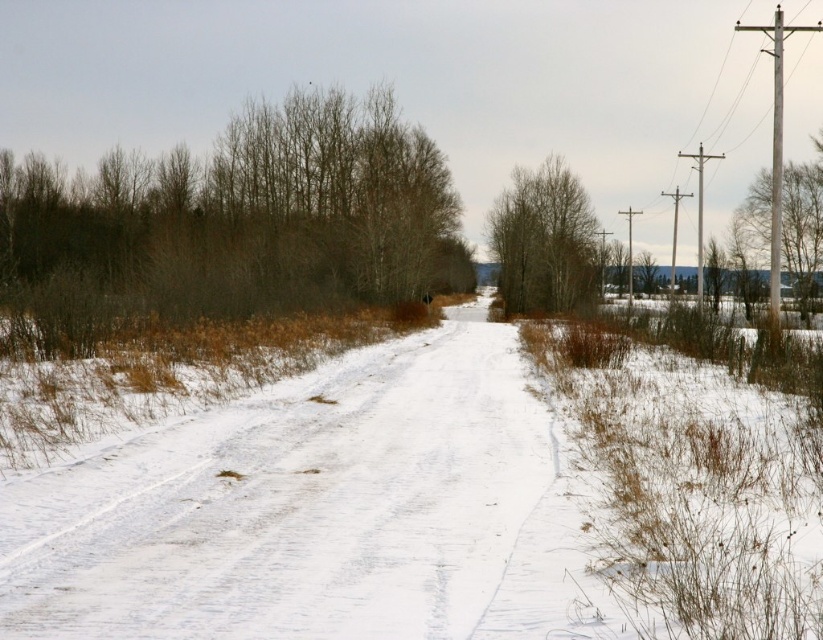
This screenshot has width=823, height=640. What do you see at coordinates (543, 241) in the screenshot?
I see `brown/dry wood at center` at bounding box center [543, 241].

Which is behind, point (573, 218) or point (751, 228)?

The point (751, 228) is more distant.

Where is `brown/dry wood at center`? The height and width of the screenshot is (640, 823). brown/dry wood at center is located at coordinates (543, 241).

Can you confirm if brown/dry wood at left is positioned above smooth wood pole at right?

Indeed, brown/dry wood at left is positioned over smooth wood pole at right.

Which is behind, point (379, 291) or point (746, 221)?

Point (746, 221)

Who is more distant from viewer, (228, 134) or (807, 276)?

Positioned behind is point (228, 134).

The width and height of the screenshot is (823, 640). Find the location of `brown/dry wood at left`. brown/dry wood at left is located at coordinates (231, 225).

Is brown/dry wood at left taller than brown/dry wood at center?

Indeed, brown/dry wood at left has a greater height compared to brown/dry wood at center.

Is brown/dry wood at left to the right of brown/dry wood at center from the viewer's perspective?

Incorrect, brown/dry wood at left is not on the right side of brown/dry wood at center.

Image resolution: width=823 pixels, height=640 pixels. Find the location of `brown/dry wood at left`. brown/dry wood at left is located at coordinates (231, 225).